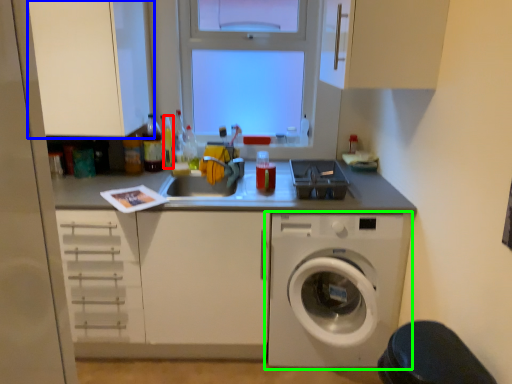
Question: Estimate the real-world distances between objects in this image. Which object is closer to bottle (highlighted by a red box), cabinetry (highlighted by a blue box) or washing machine (highlighted by a green box)?

Choices:
 (A) cabinetry
 (B) washing machine

Answer: (A)